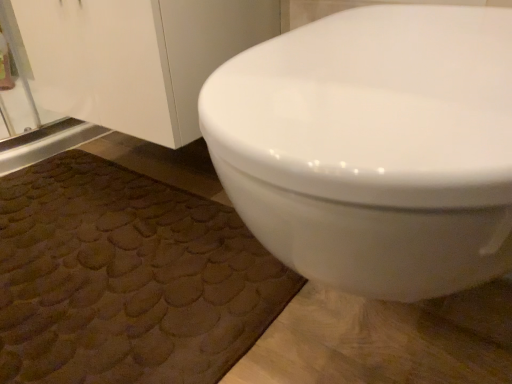
Question: Visually, is white glossy toilet at upper right positioned to the left or to the right of brown textured bath mat at lower left?

Choices:
 (A) right
 (B) left

Answer: (A)

Question: Looking at their shapes, would you say white glossy toilet at upper right is wider or thinner than brown textured bath mat at lower left?

Choices:
 (A) thin
 (B) wide

Answer: (A)

Question: From a real-world perspective, is white glossy toilet at upper right physically located above or below brown textured bath mat at lower left?

Choices:
 (A) above
 (B) below

Answer: (A)

Question: Considering the positions of brown textured bath mat at lower left and white glossy toilet at upper right in the image, is brown textured bath mat at lower left bigger or smaller than white glossy toilet at upper right?

Choices:
 (A) small
 (B) big

Answer: (A)

Question: Looking at their shapes, would you say brown textured bath mat at lower left is wider or thinner than white glossy toilet at upper right?

Choices:
 (A) wide
 (B) thin

Answer: (A)

Question: From the image's perspective, is brown textured bath mat at lower left above or below white glossy toilet at upper right?

Choices:
 (A) above
 (B) below

Answer: (B)

Question: Based on their positions, is brown textured bath mat at lower left located to the left or right of white glossy toilet at upper right?

Choices:
 (A) right
 (B) left

Answer: (B)